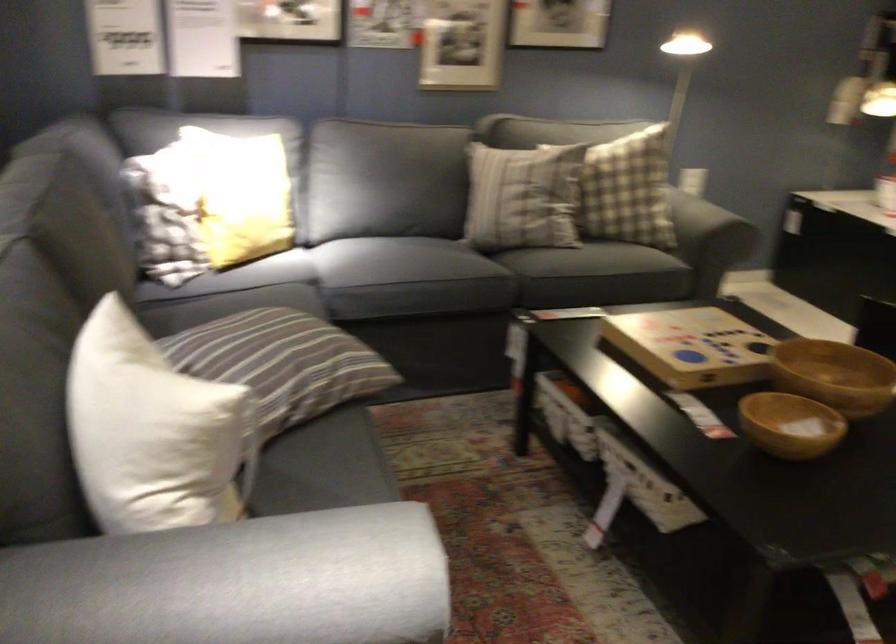
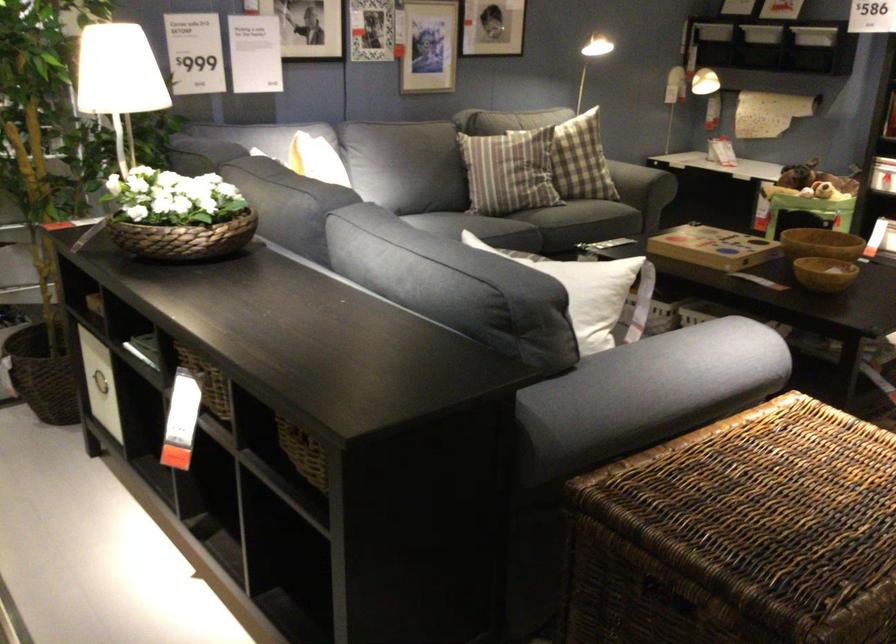
Where in the second image is the point corresponding to [781,371] from the first image?

(821, 243)